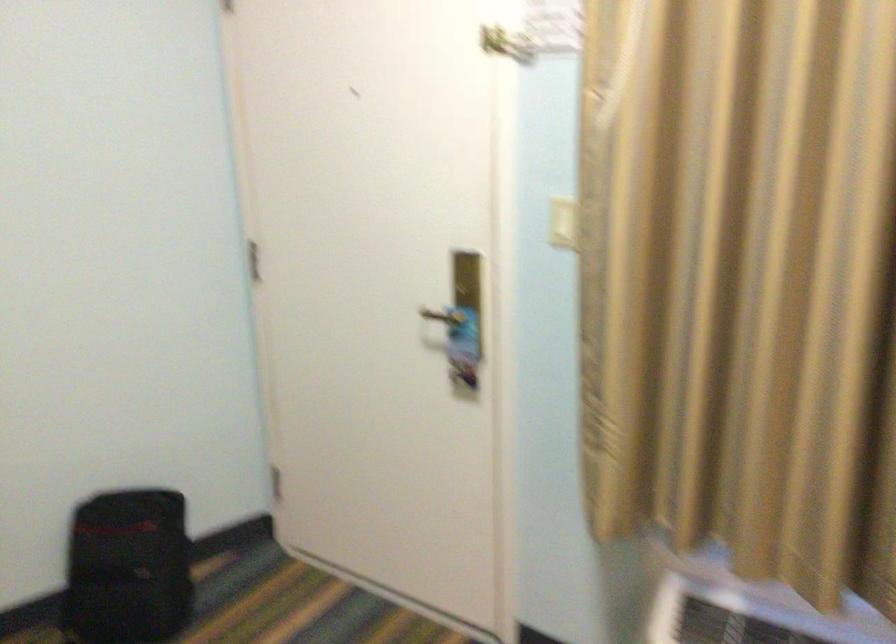
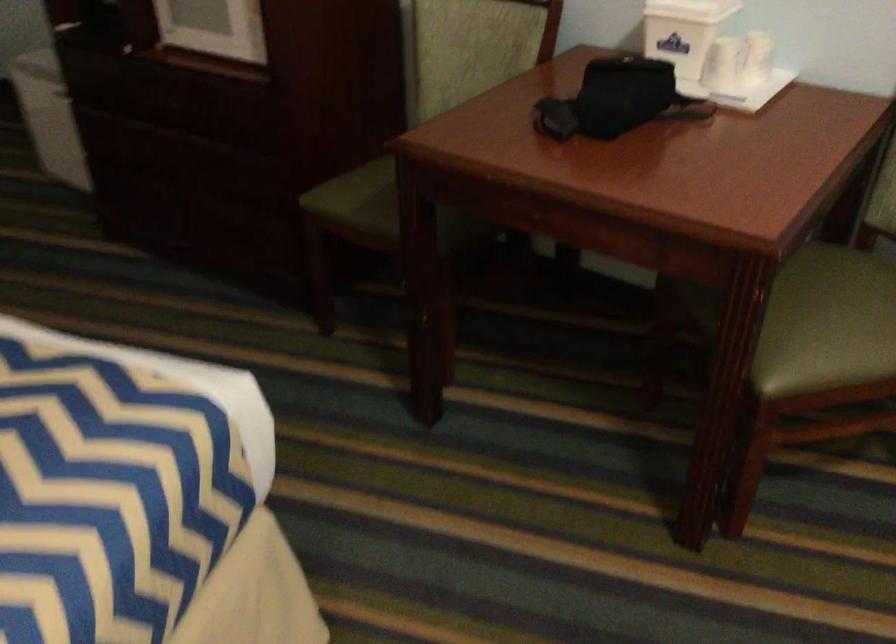
The first image is from the beginning of the video and the second image is from the end. How did the camera likely rotate when shooting the video?

The camera rotated toward left-down.